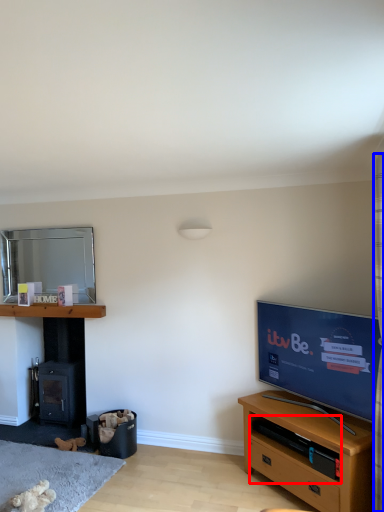
Question: Among these objects, which one is nearest to the camera, shelf (highlighted by a red box) or curtain (highlighted by a blue box)?

Choices:
 (A) shelf
 (B) curtain

Answer: (B)